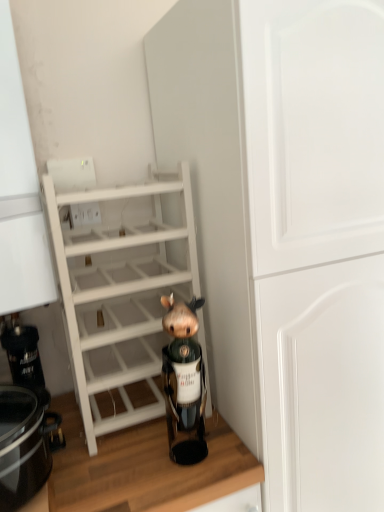
You are a GUI agent. You are given a task and a screenshot of the screen. Output one action in this format:
    pyautogui.click(x=<x>, y=<y>)
    Task: Click on the vacant area that lies to the right of black glossy crock pot at lower left
    The height and width of the screenshot is (512, 384).
    Given the screenshot: What is the action you would take?
    pyautogui.click(x=123, y=470)